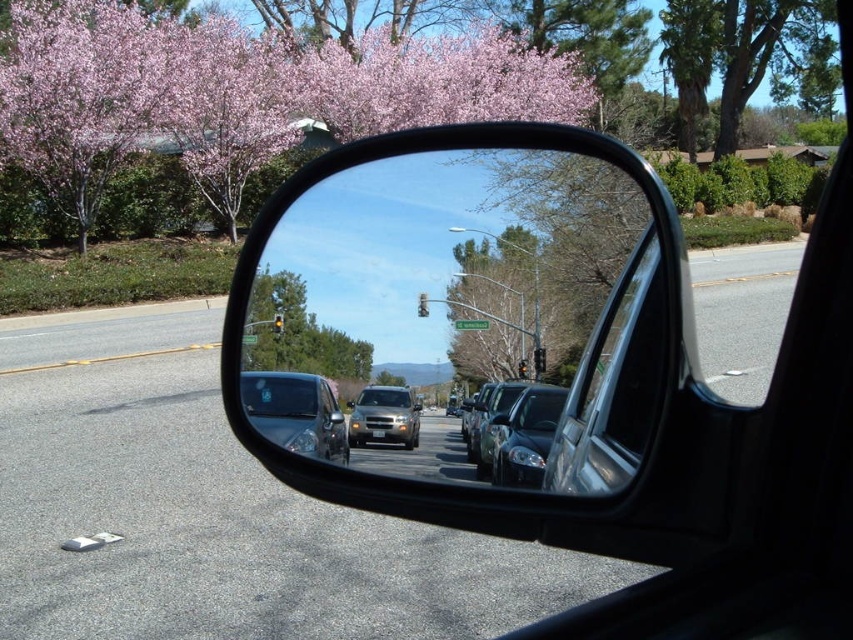
Is pink blossoms at upper left above satin silver sedan at center?

Yes.

Is point (146, 192) positioned before point (297, 372)?

No, (146, 192) is behind (297, 372).

Is point (677, 131) less distant than point (318, 422)?

No, it is behind (318, 422).

You are a GUI agent. You are given a task and a screenshot of the screen. Output one action in this format:
    pyautogui.click(x=<x>, y=<y>)
    Task: Click on the pink blossoms at upper left
    The width and height of the screenshot is (853, 640).
    Given the screenshot: What is the action you would take?
    pyautogui.click(x=149, y=202)

Can you confirm if clear glass car window at center is positioned below metallic silver suv at center?

Actually, clear glass car window at center is above metallic silver suv at center.

Is clear glass car window at center closer to the viewer compared to metallic silver suv at center?

Yes.

Which is behind, point (585, 436) or point (383, 403)?

Point (383, 403)

The width and height of the screenshot is (853, 640). Identify the location of clear glass car window at center. (614, 384).

Is point (602, 476) in front of point (271, 353)?

Yes, point (602, 476) is closer to viewer.

Which is below, clear glass car window at center or green leafy tree at center?

clear glass car window at center

The width and height of the screenshot is (853, 640). Describe the element at coordinates (614, 384) in the screenshot. I see `clear glass car window at center` at that location.

Locate an element on the screen. This screenshot has height=640, width=853. clear glass car window at center is located at coordinates (614, 384).